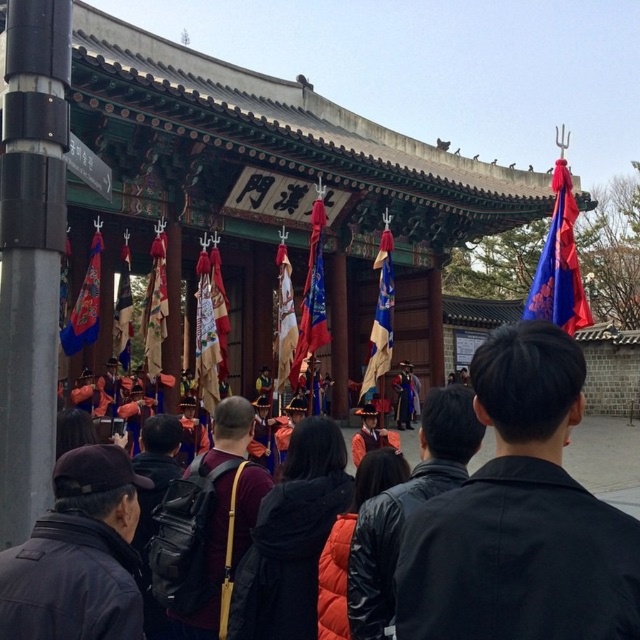
Can you confirm if black leather jacket at center is positioned below red silk flag at center?

Yes.

Who is shorter, black leather jacket at center or red silk flag at center?

black leather jacket at center is shorter.

Image resolution: width=640 pixels, height=640 pixels. In order to click on black leather jacket at center in this screenshot , I will do `click(520, 516)`.

Is dark gray jacket at lower left smaller than dark gray jacket at center?

Yes.

Who is more distant from viewer, (104, 467) or (324, 433)?

Point (324, 433)

Identify the location of dark gray jacket at lower left. The height and width of the screenshot is (640, 640). (77, 556).

Does blue silk flag at center have a smaller size compared to silk red flag at center?

No.

Is blue silk flag at center further to the viewer compared to silk red flag at center?

Yes, it is.

Which is behind, point (381, 234) or point (284, 262)?

Positioned behind is point (381, 234).

Where is `blue silk flag at center`? The width and height of the screenshot is (640, 640). blue silk flag at center is located at coordinates (380, 314).